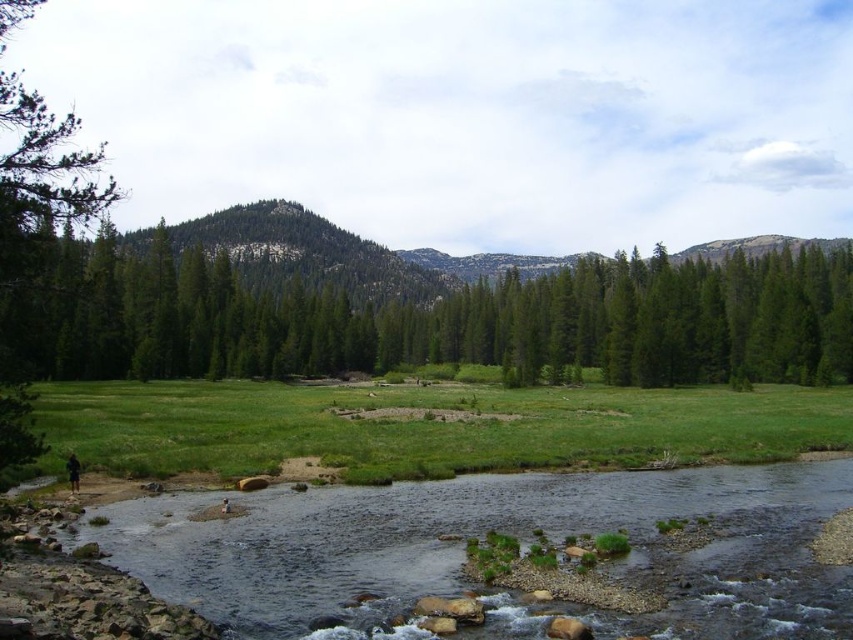
You are a hiker trying to cross the river. You see the green matte tree at center and the clear water at river center. Which object is closer to your current position if you are standing on the left bank?

The green matte tree at center is closer to your current position because it is located to the left of the clear water at river center, meaning it is nearer to the left bank where you are standing.

You are standing at the edge of the green grassy field at lower center and want to cross to the other side of the river. Can you see the clear water at river center from your current position?

Yes, the clear water at river center is to the left of the green grassy field at lower center, so you can see it from your position.

You are standing at the edge of the green grassy field at lower center and want to cross to the other side of the river. Can you see the clear water at river center from your current position?

Yes, because the clear water at river center is in front of the green grassy field at lower center, so it is directly visible from your position there.